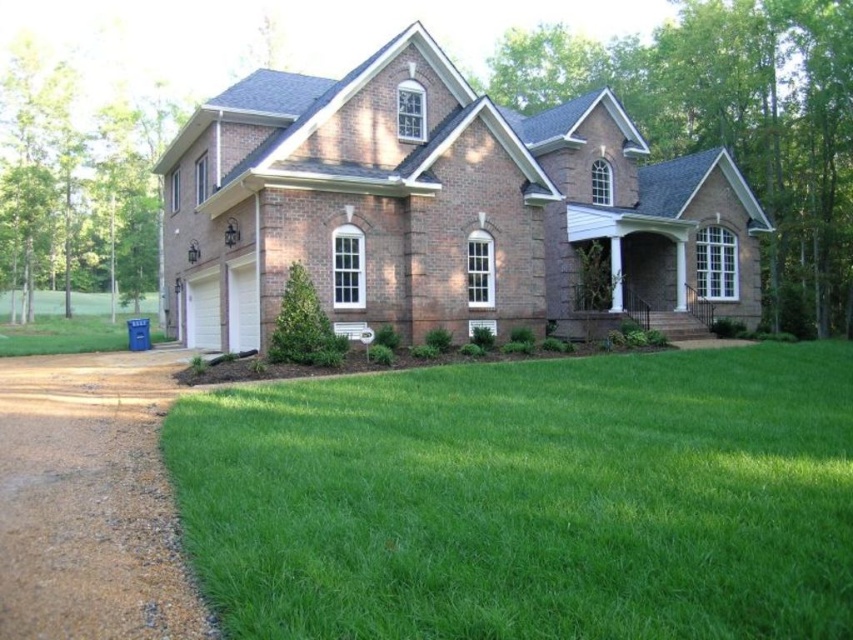
Is green grass at lower center smaller than brown gravel driveway at lower left?

Indeed, green grass at lower center has a smaller size compared to brown gravel driveway at lower left.

Is point (204, 428) less distant than point (64, 596)?

No.

You are a GUI agent. You are given a task and a screenshot of the screen. Output one action in this format:
    pyautogui.click(x=<x>, y=<y>)
    Task: Click on the green grass at lower center
    This screenshot has width=853, height=640.
    Given the screenshot: What is the action you would take?
    pyautogui.click(x=527, y=499)